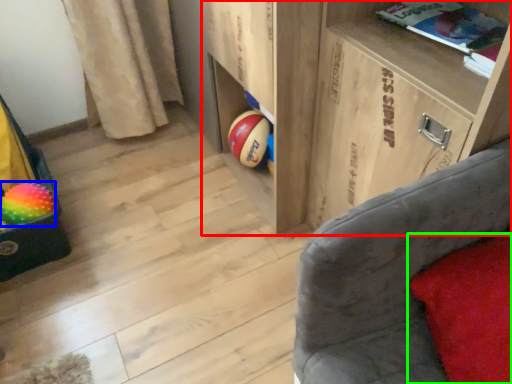
Question: Estimate the real-world distances between objects in this image. Which object is farther from shelf (highlighted by a red box), beach ball (highlighted by a blue box) or pillow (highlighted by a green box)?

Choices:
 (A) beach ball
 (B) pillow

Answer: (A)